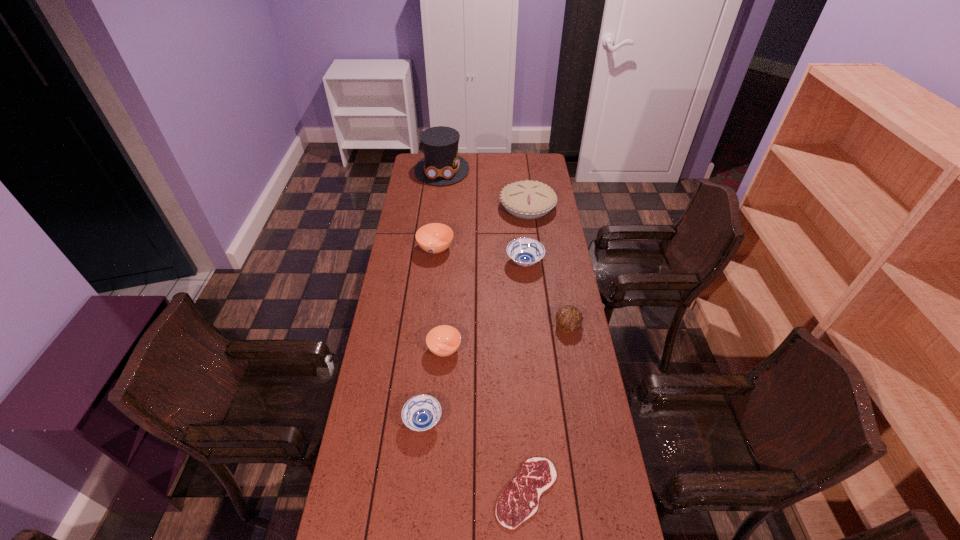
The image size is (960, 540). Find the location of `object that ranks as the fifth closest to the smaller blue soup bowl`. object that ranks as the fifth closest to the smaller blue soup bowl is located at coordinates (434, 238).

Choose which soup bowl is the third nearest neighbor to the shortest object. Please provide its 2D coordinates. Your answer should be formatted as a tuple, i.e. [(x, y)], where the tuple contains the x and y coordinates of a point satisfying the conditions above.

[(525, 252)]

Identify which soup bowl is the second closest to the bigger blue soup bowl. Please provide its 2D coordinates. Your answer should be formatted as a tuple, i.e. [(x, y)], where the tuple contains the x and y coordinates of a point satisfying the conditions above.

[(444, 340)]